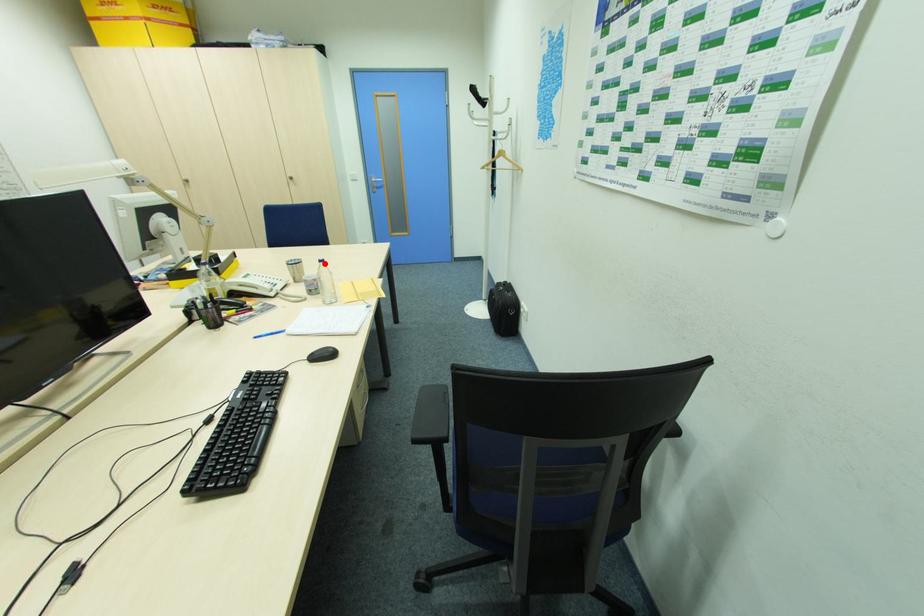
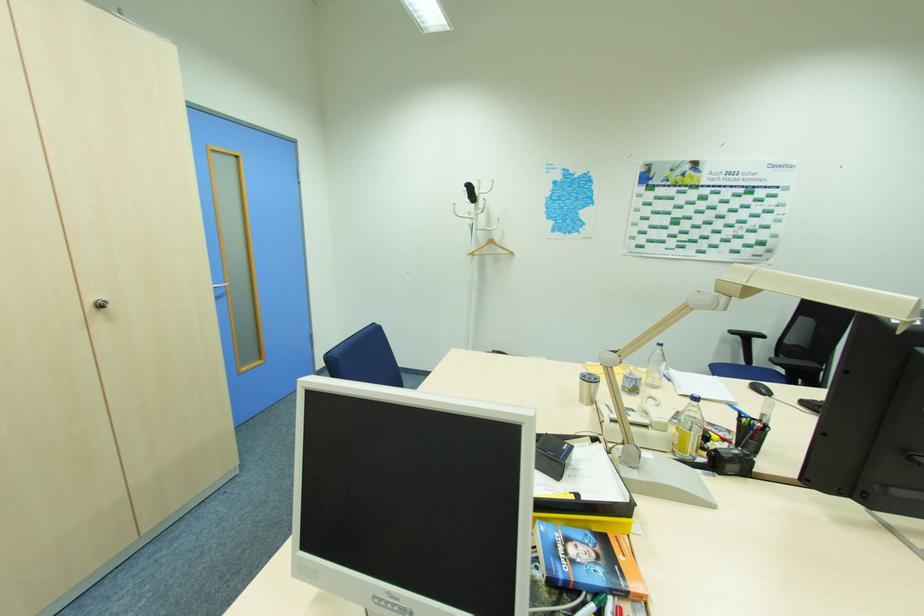
The point at the highlighted location is marked in the first image. Where is the corresponding point in the second image?

(663, 347)